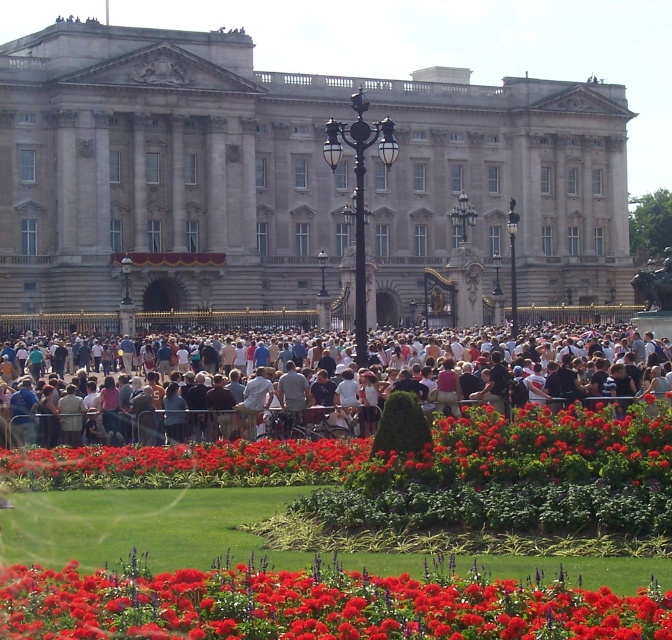
Can you confirm if stone facade palace at center is taller than bright red petals at center?

Correct, stone facade palace at center is much taller as bright red petals at center.

Can you confirm if stone facade palace at center is bigger than bright red petals at center?

Yes, stone facade palace at center is bigger than bright red petals at center.

Is point (597, 292) positioned after point (456, 608)?

That is True.

At what (x,y) coordinates should I click in order to perform the action: click on stone facade palace at center. Please return your answer as a coordinate pair (x, y). The height and width of the screenshot is (640, 672). Looking at the image, I should click on (288, 179).

Can you confirm if stone facade palace at center is positioned above vivid red petals at center?

Yes, stone facade palace at center is above vivid red petals at center.

Is point (214, 225) positioned behind point (24, 477)?

Yes, point (214, 225) is farther from viewer.

Identify the location of stone facade palace at center. Image resolution: width=672 pixels, height=640 pixels. (288, 179).

From the picture: Who is more forward, (159,60) or (187,360)?

Positioned in front is point (187,360).

Can you confirm if stone facade palace at center is positioned to the left of light brown wooden bench at center?

No, stone facade palace at center is not to the left of light brown wooden bench at center.

Is point (50, 138) closer to viewer compared to point (247, 420)?

No, (50, 138) is behind (247, 420).

Locate an element on the screen. The image size is (672, 640). stone facade palace at center is located at coordinates (288, 179).